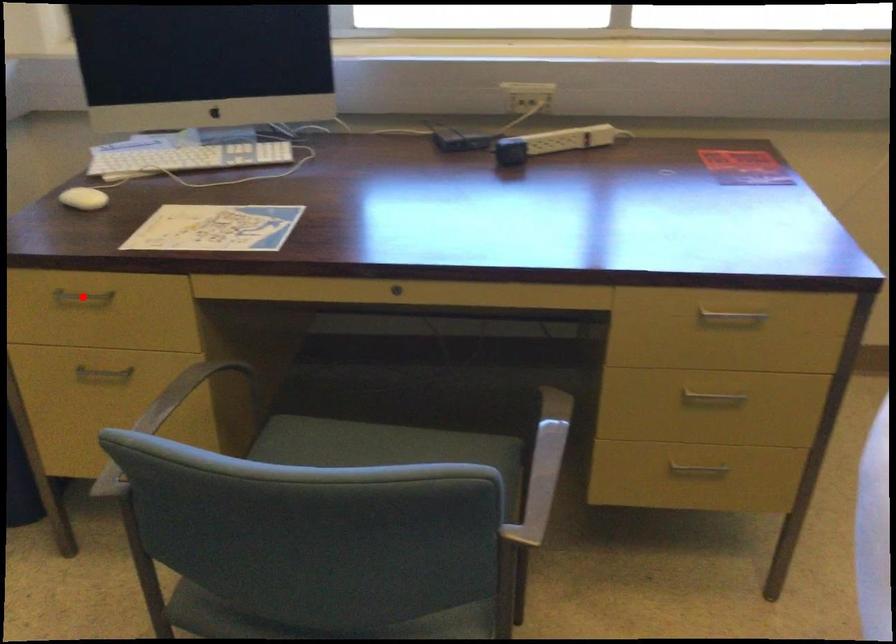
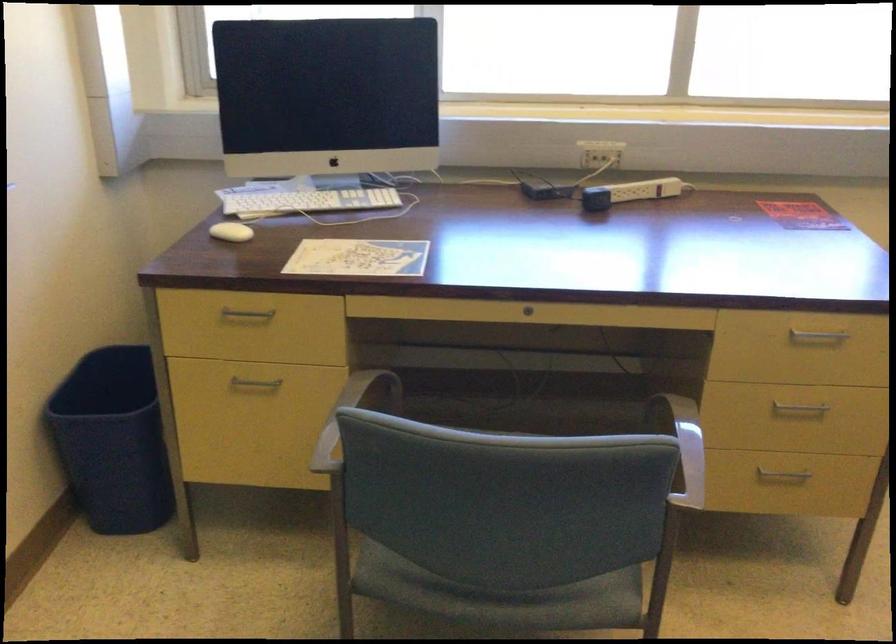
Question: I am providing you with two images of the same scene from different viewpoints. Image1 has a red point marked. In image2, the corresponding 3D location appears at what relative position? Reply with the corresponding letter.

Choices:
 (A) Closer
 (B) Farther

Answer: (B)